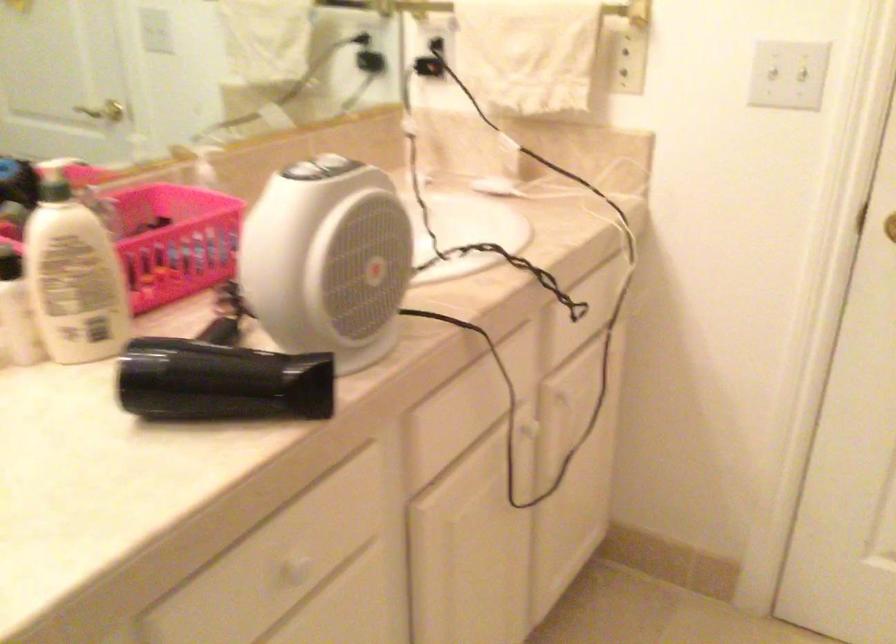
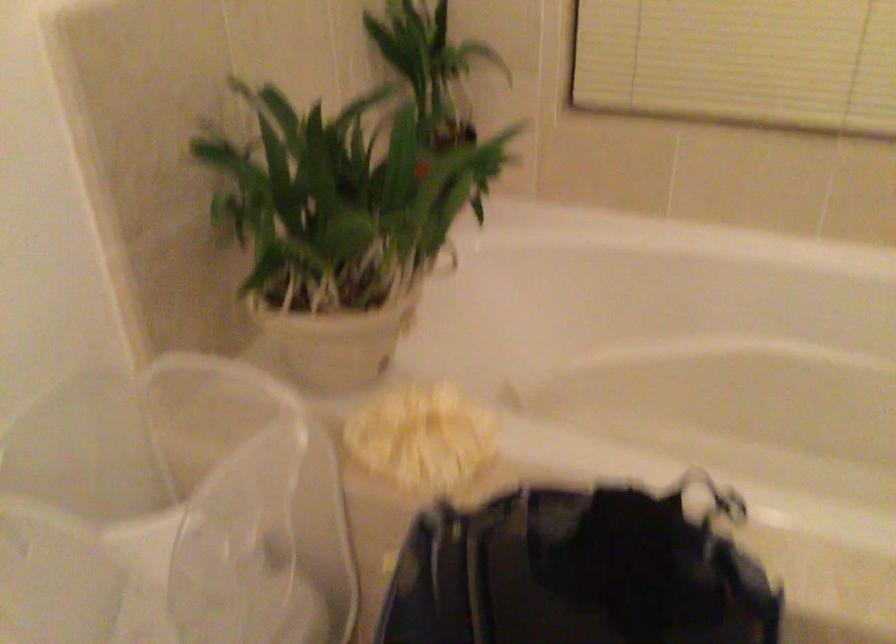
Based on the continuous images, in which direction is the camera rotating?

The camera's rotation is toward right-down.